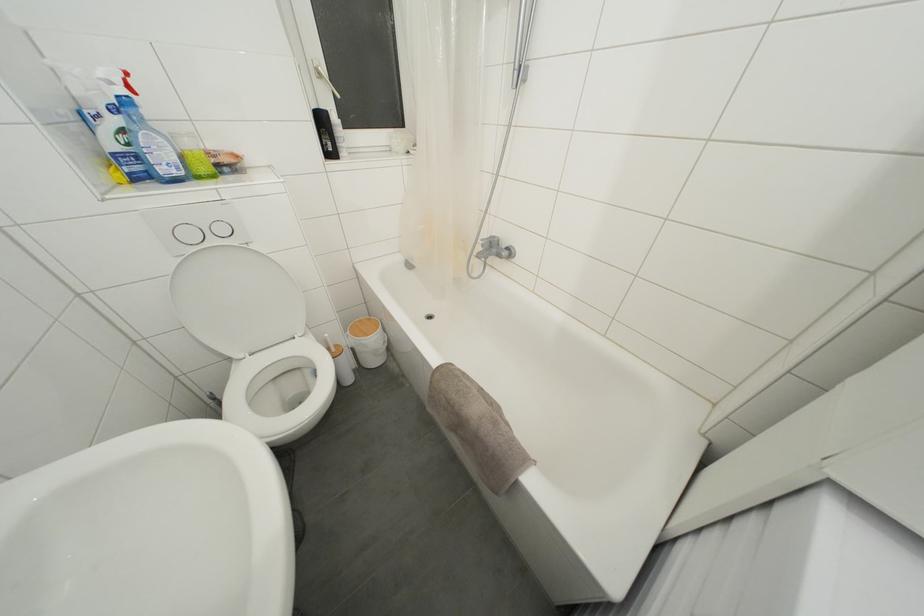
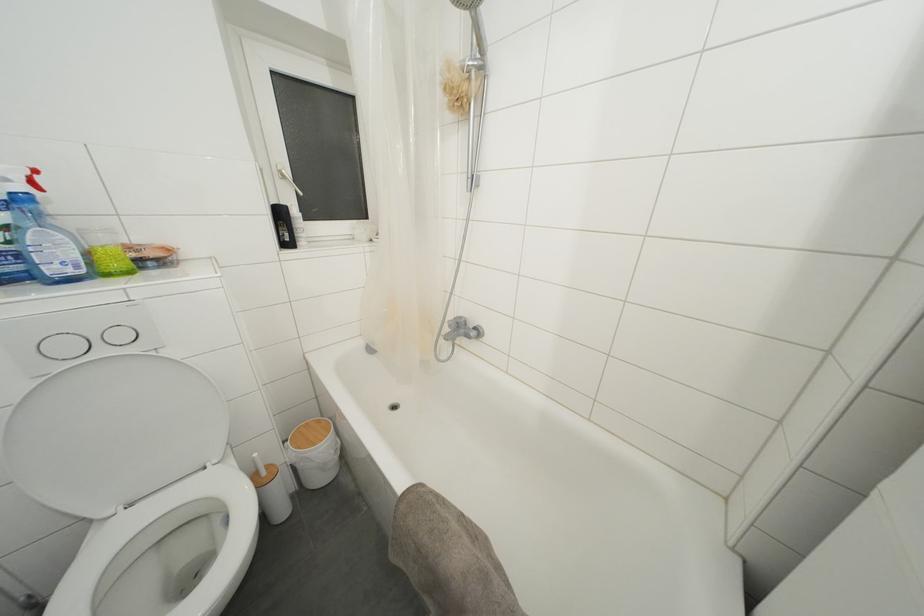
In the second image, find the point that corresponds to the point at 134,92 in the first image.

(37, 188)